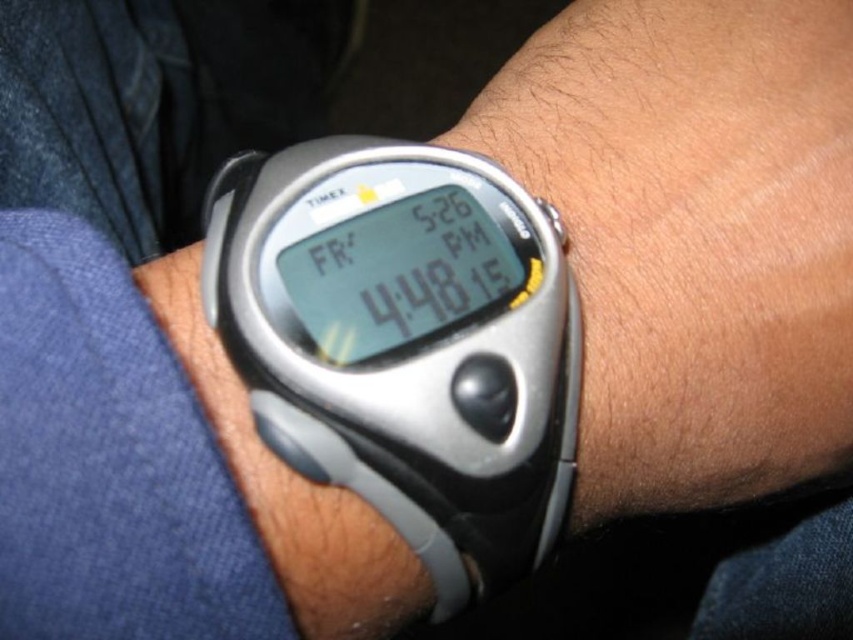
Between silver/black digital watch at center and silver/black plastic watch at center, which one has more height?

With more height is silver/black digital watch at center.

Can you confirm if silver/black digital watch at center is bigger than silver/black plastic watch at center?

Yes, silver/black digital watch at center is bigger than silver/black plastic watch at center.

Is point (450, 198) more distant than point (294, 486)?

Yes, point (450, 198) is behind point (294, 486).

Find the location of a particular element. The width and height of the screenshot is (853, 640). silver/black digital watch at center is located at coordinates (405, 340).